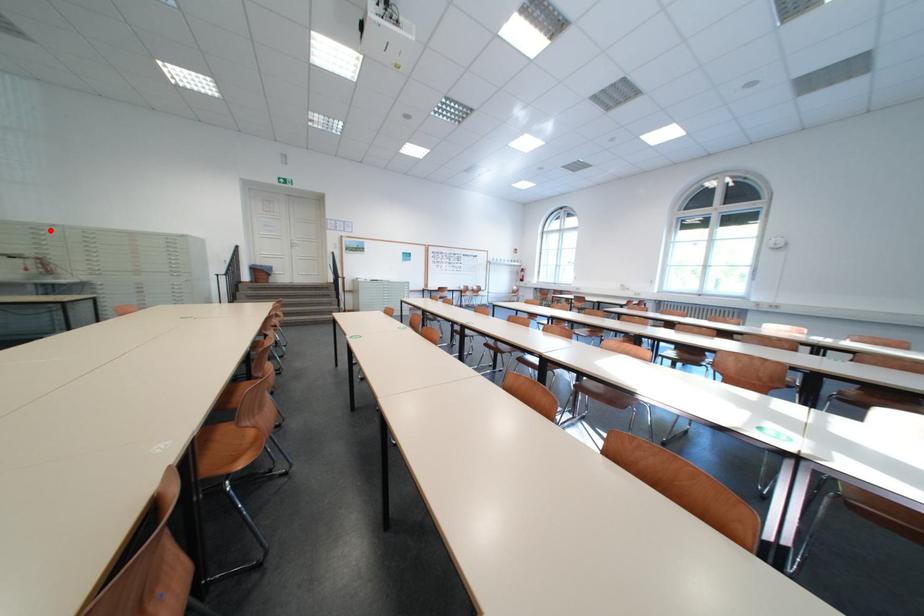
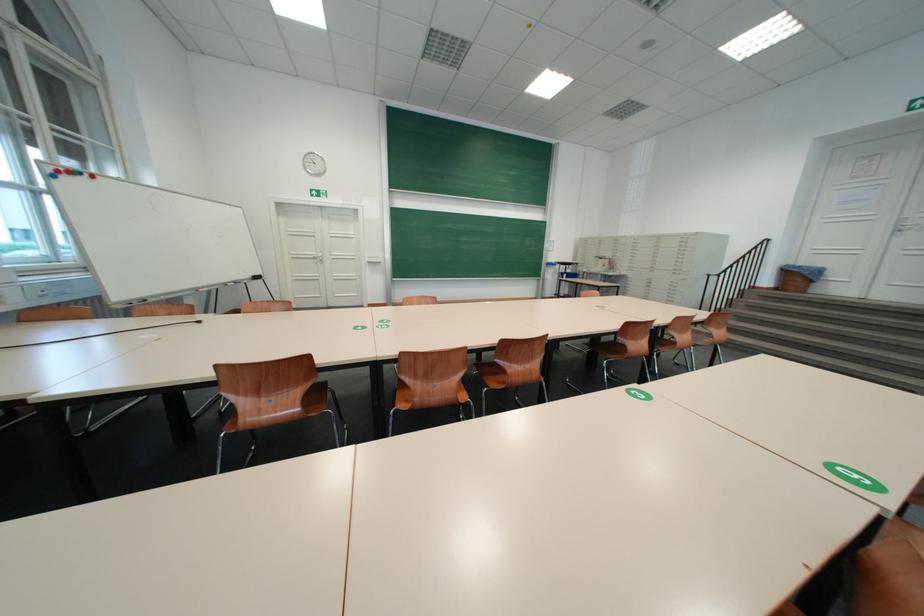
Question: I am providing you with two images of the same scene from different viewpoints. Image1 has a red point marked. In image2, the corresponding 3D location appears at what relative position? Reply with the corresponding letter.

Choices:
 (A) Closer
 (B) Farther

Answer: (A)